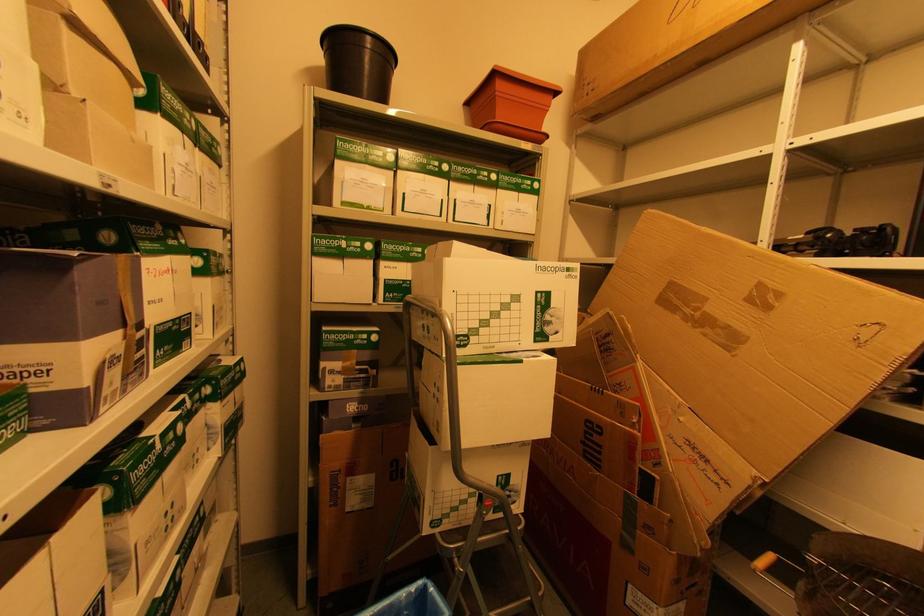
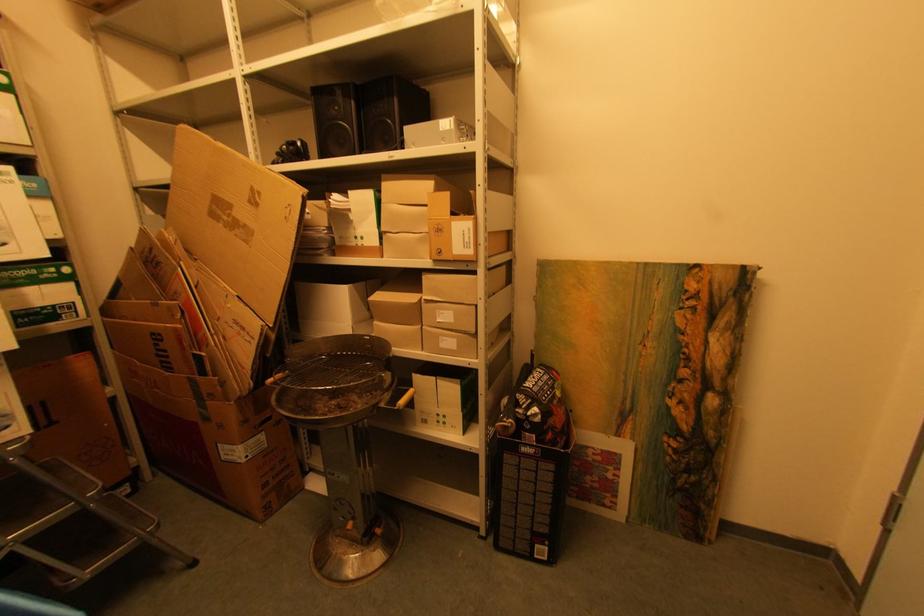
Question: The camera is either moving clockwise (left) or counter-clockwise (right) around the object. The first image is from the beginning of the video and the second image is from the end. Is the camera moving left or right when shooting the video?

Choices:
 (A) Left
 (B) Right

Answer: (A)